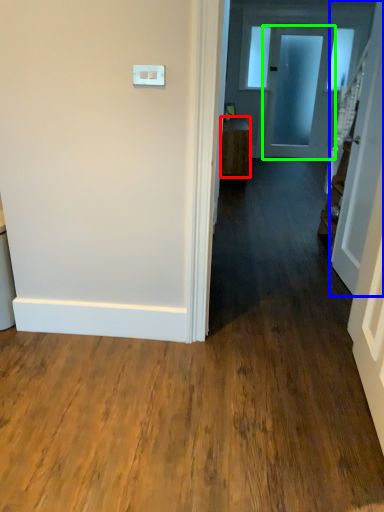
Question: Which is farther away from furniture (highlighted by a red box)? door (highlighted by a blue box) or door (highlighted by a green box)?

Choices:
 (A) door
 (B) door

Answer: (A)